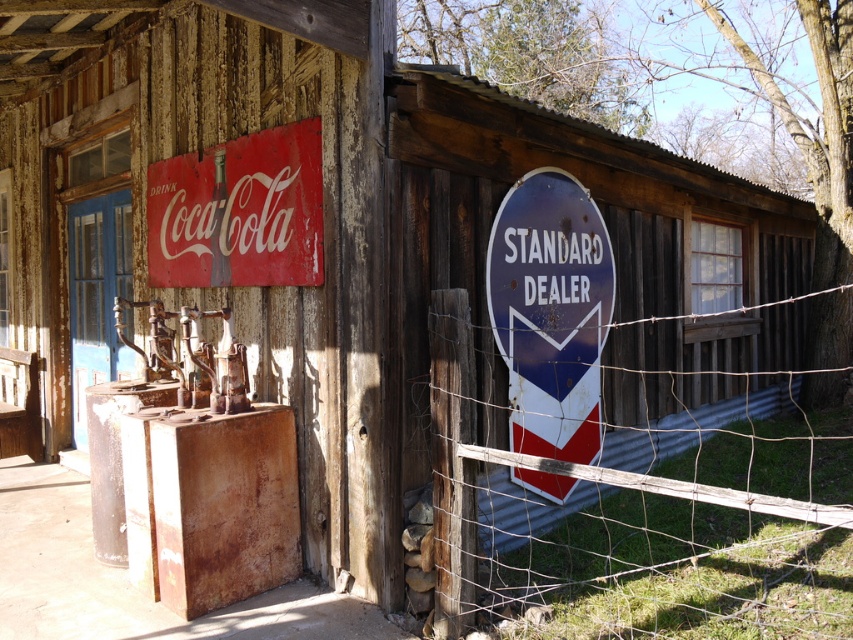
Is wire mesh at right wider than red matte coca-cola sign at upper left?

Correct, the width of wire mesh at right exceeds that of red matte coca-cola sign at upper left.

Image resolution: width=853 pixels, height=640 pixels. What do you see at coordinates (660, 548) in the screenshot? I see `wire mesh at right` at bounding box center [660, 548].

Does point (613, 604) lie in front of point (311, 236)?

That is True.

In order to click on wire mesh at right in this screenshot , I will do `click(660, 548)`.

Does metallic blue sign at right appear under red matte coca-cola sign at upper left?

Indeed, metallic blue sign at right is positioned under red matte coca-cola sign at upper left.

Is point (495, 241) closer to viewer compared to point (281, 227)?

No.

At what (x,y) coordinates should I click in order to perform the action: click on metallic blue sign at right. Please return your answer as a coordinate pair (x, y). Looking at the image, I should click on (550, 312).

Can you confirm if wire mesh at right is smaller than metallic blue sign at right?

No.

The image size is (853, 640). Describe the element at coordinates (660, 548) in the screenshot. I see `wire mesh at right` at that location.

Is point (643, 528) more distant than point (537, 392)?

No.

At what (x,y) coordinates should I click in order to perform the action: click on wire mesh at right. Please return your answer as a coordinate pair (x, y). This screenshot has width=853, height=640. Looking at the image, I should click on (660, 548).